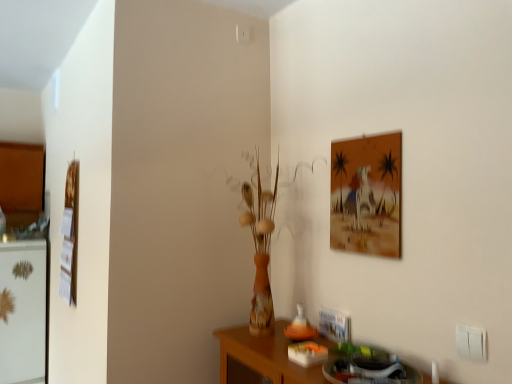
Question: Is matte orange painting at upper right, acting as the 1th picture frame starting from the right, placed right next to wooden picture frame at left, marked as the first picture frame in a left-to-right arrangement?

Choices:
 (A) no
 (B) yes

Answer: (A)

Question: Can you confirm if matte orange painting at upper right, which is the second picture frame from left to right, is thinner than wooden picture frame at left, marked as the first picture frame in a left-to-right arrangement?

Choices:
 (A) no
 (B) yes

Answer: (B)

Question: From the image's perspective, is matte orange painting at upper right, the 1th picture frame when ordered from front to back, under wooden picture frame at left, placed as the 2th picture frame when sorted from front to back?

Choices:
 (A) yes
 (B) no

Answer: (B)

Question: Is wooden picture frame at left, placed as the 2th picture frame when sorted from front to back, completely or partially inside matte orange painting at upper right, which is the second picture frame from left to right?

Choices:
 (A) no
 (B) yes

Answer: (A)

Question: Is matte orange painting at upper right, which appears as the second picture frame when viewed from the back, far away from wooden picture frame at left, positioned as the first picture frame in back-to-front order?

Choices:
 (A) yes
 (B) no

Answer: (A)

Question: In the image, is matte orange painting at upper right, the 1th picture frame when ordered from front to back, positioned in front of or behind white plastic electric outlet at lower right?

Choices:
 (A) behind
 (B) front

Answer: (A)

Question: Do you think matte orange painting at upper right, which appears as the second picture frame when viewed from the back, is within white plastic electric outlet at lower right, or outside of it?

Choices:
 (A) inside
 (B) outside

Answer: (B)

Question: From a real-world perspective, relative to white plastic electric outlet at lower right, is matte orange painting at upper right, which appears as the second picture frame when viewed from the back, vertically above or below?

Choices:
 (A) below
 (B) above

Answer: (B)

Question: Is matte orange painting at upper right, acting as the 1th picture frame starting from the right, to the left or to the right of white plastic electric outlet at lower right in the image?

Choices:
 (A) right
 (B) left

Answer: (B)

Question: In terms of width, does wooden picture frame at left, placed as the 2th picture frame when sorted from front to back, look wider or thinner when compared to matte orange painting at upper right, which appears as the second picture frame when viewed from the back?

Choices:
 (A) wide
 (B) thin

Answer: (A)

Question: Is point (66, 271) closer or farther from the camera than point (370, 218)?

Choices:
 (A) closer
 (B) farther

Answer: (B)

Question: Considering the positions of wooden picture frame at left, marked as the first picture frame in a left-to-right arrangement, and matte orange painting at upper right, acting as the 1th picture frame starting from the right, in the image, is wooden picture frame at left, marked as the first picture frame in a left-to-right arrangement, bigger or smaller than matte orange painting at upper right, acting as the 1th picture frame starting from the right,?

Choices:
 (A) big
 (B) small

Answer: (A)

Question: From their relative heights in the image, would you say wooden picture frame at left, marked as the first picture frame in a left-to-right arrangement, is taller or shorter than matte orange painting at upper right, which appears as the second picture frame when viewed from the back?

Choices:
 (A) short
 (B) tall

Answer: (B)

Question: Considering the positions of point (456, 337) and point (364, 168), is point (456, 337) closer or farther from the camera than point (364, 168)?

Choices:
 (A) farther
 (B) closer

Answer: (B)

Question: Would you say white plastic electric outlet at lower right is to the left or to the right of matte orange painting at upper right, which is the second picture frame from left to right, in the picture?

Choices:
 (A) right
 (B) left

Answer: (A)